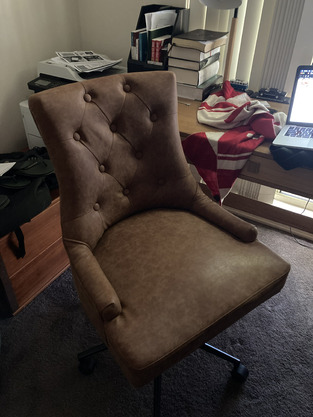
In order to click on chair in this screenshot , I will do `click(103, 101)`.